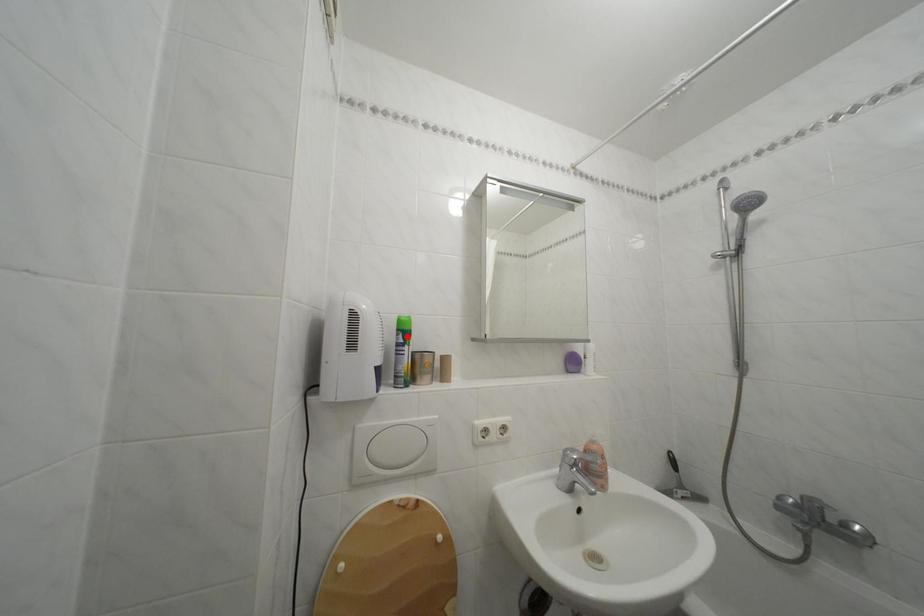
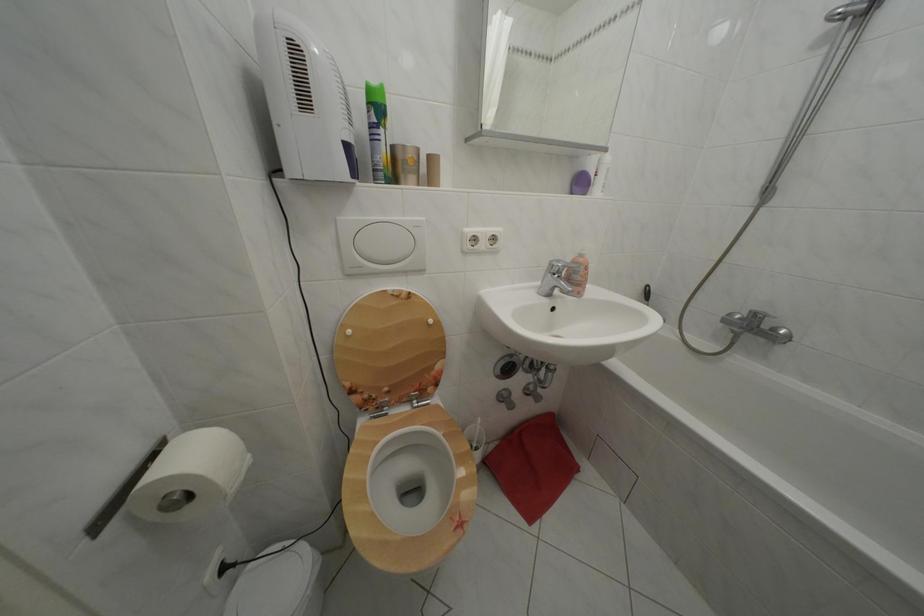
In the second image, find the point that corresponds to the highlighted location in the first image.

(378, 110)